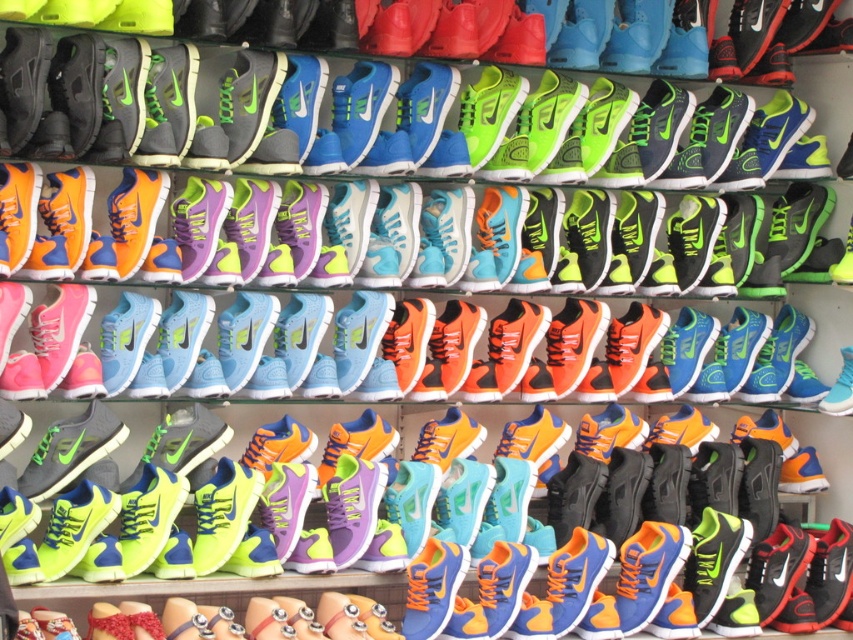
Question: Can you confirm if matte purple sneaker at center is bigger than shiny blue sneakers at center?

Choices:
 (A) no
 (B) yes

Answer: (A)

Question: Can you confirm if matte purple sneaker at center is bigger than shiny blue sneakers at center?

Choices:
 (A) no
 (B) yes

Answer: (A)

Question: Which of the following is the farthest from the observer?

Choices:
 (A) matte purple sneaker at center
 (B) shiny blue sneakers at center

Answer: (B)

Question: Is matte purple sneaker at center to the left of shiny blue sneakers at center from the viewer's perspective?

Choices:
 (A) yes
 (B) no

Answer: (A)